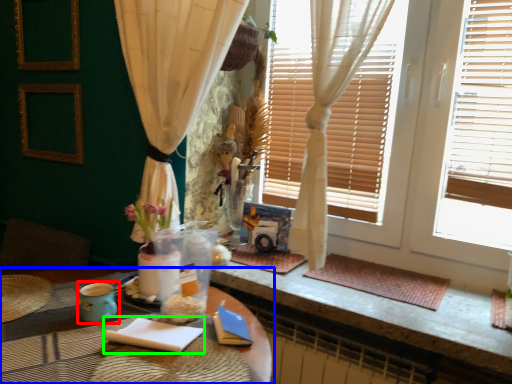
Question: Estimate the real-world distances between objects in this image. Which object is farther from teal (highlighted by a red box), table (highlighted by a blue box) or notepad (highlighted by a green box)?

Choices:
 (A) table
 (B) notepad

Answer: (A)